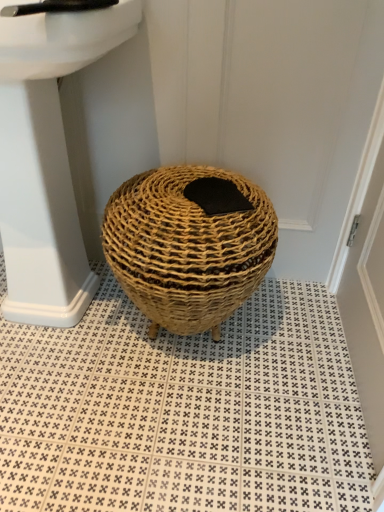
Identify the location of vacant space to the right of natural woven basket at center. (287, 333).